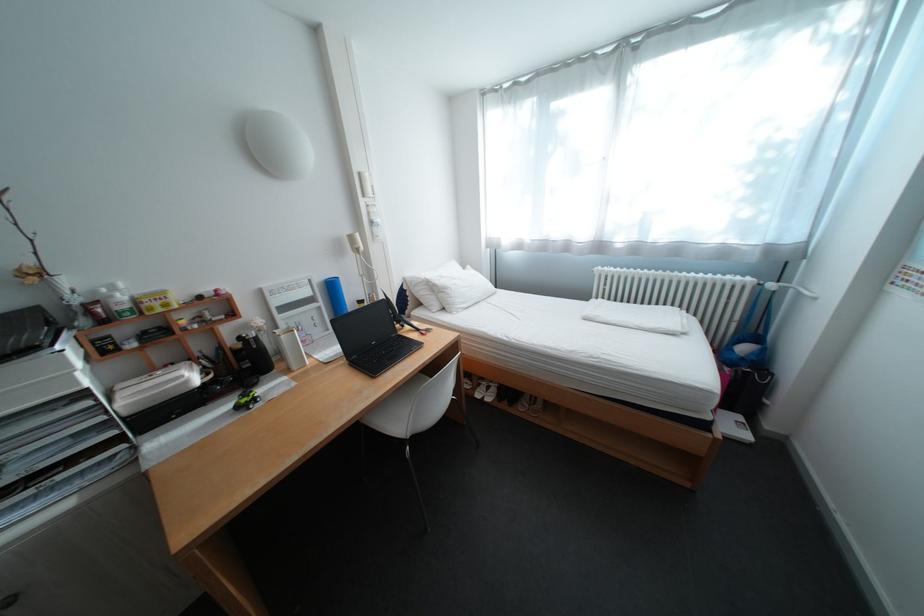
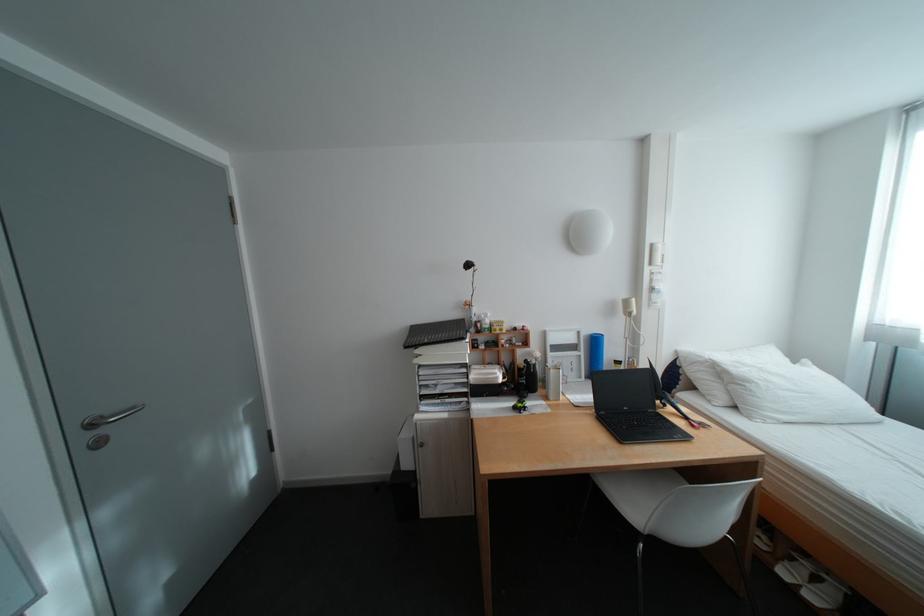
The point at (375, 426) is marked in the first image. Where is the corresponding point in the second image?

(606, 483)